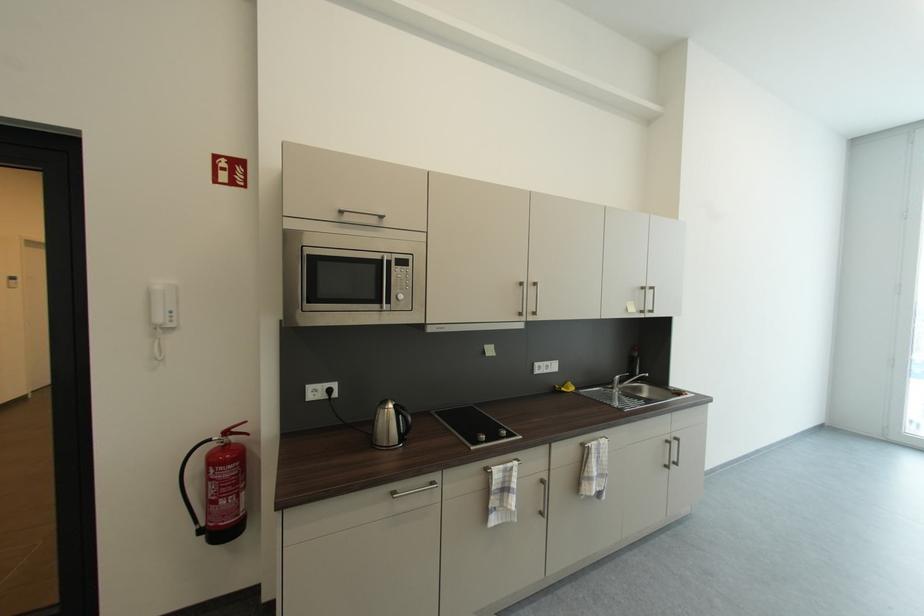
At what (x,y) coordinates should I click in order to perform the action: click on stovetop knob. Please return your answer as a coordinate pair (x, y). Image resolution: width=924 pixels, height=616 pixels. Looking at the image, I should click on (500, 435).